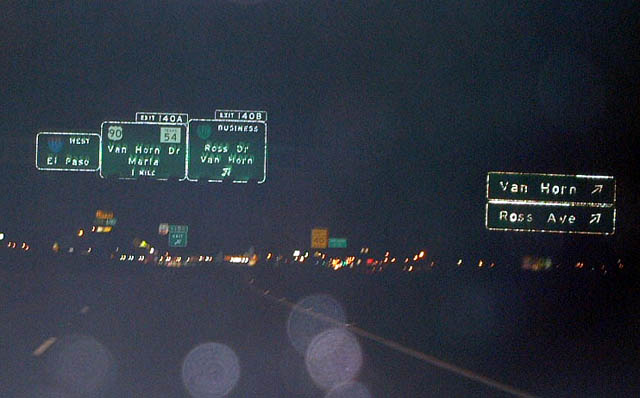
The height and width of the screenshot is (398, 640). Identify the location of exit b sign. (258, 115).